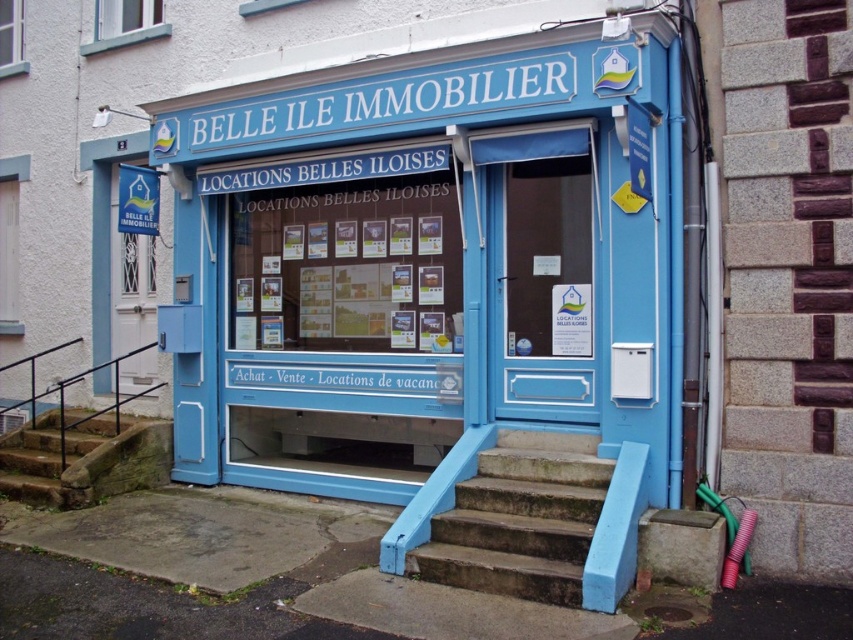
You are a customer looking for the real estate office. You see the blue fabric banner at left and the white paper posters at center. Which one is positioned to the right of the other?

The white paper posters at center is to the right of blue fabric banner at left.

You are standing in front of the real estate agency and need to locate the blue painted wood storefront at center. According to the coordinates provided, where exactly is it positioned?

The blue painted wood storefront at center is located at point (428, 262).

You are a delivery person trying to deliver a package to the blue painted wood storefront at center. The package is too large to fit through the entrance door. You notice the concrete stairs at center nearby. Can you use the stairs to reach the storefront?

The blue painted wood storefront at center is wider than the concrete stairs at center, so the stairs may not be wide enough to accommodate the large package. You should check if there is another entrance or a different route that can accommodate the package size.